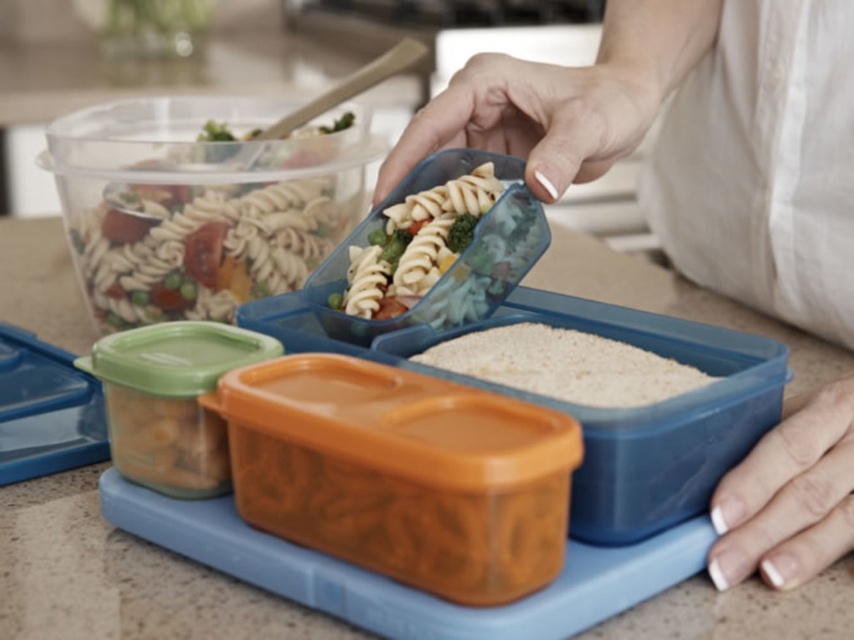
Question: Does translucent plastic pasta at upper left appear on the right side of translucent plastic pasta at center?

Choices:
 (A) yes
 (B) no

Answer: (B)

Question: Which point is farther to the camera?

Choices:
 (A) (642, 33)
 (B) (431, 228)
 (C) (162, 276)
 (D) (702, 384)

Answer: (A)

Question: Which object appears farthest from the camera in this image?

Choices:
 (A) translucent plastic pasta at center
 (B) translucent plastic pasta at upper left
 (C) white matte hand at upper center
 (D) white matte rice at center

Answer: (B)

Question: Among these objects, which one is nearest to the camera?

Choices:
 (A) white matte hand at upper center
 (B) translucent plastic pasta at upper left

Answer: (A)

Question: Does white matte hand at upper center appear on the left side of white matte rice at center?

Choices:
 (A) no
 (B) yes

Answer: (A)

Question: Is translucent plastic pasta at upper left bigger than translucent plastic pasta at center?

Choices:
 (A) yes
 (B) no

Answer: (A)